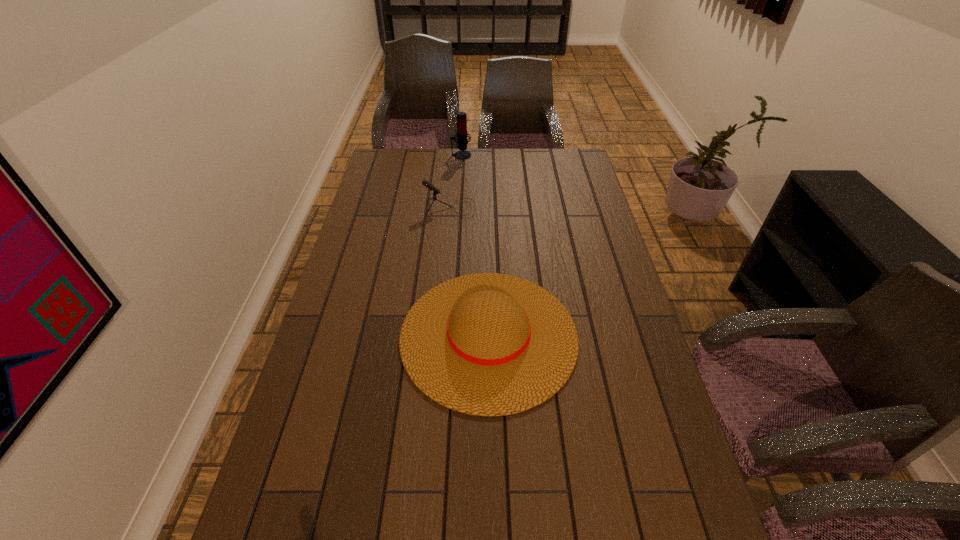
Identify which microphone is the nearest to the nearest object. Please provide its 2D coordinates. Your answer should be formatted as a tuple, i.e. [(x, y)], where the tuple contains the x and y coordinates of a point satisfying the conditions above.

[(430, 186)]

This screenshot has width=960, height=540. I want to click on vacant space that satisfies the following two spatial constraints: 1. on the back side of the nearest object; 2. on the stand of the nearer microphone, so click(x=487, y=208).

Identify the location of vacant position in the image that satisfies the following two spatial constraints: 1. on the stand of the nearest object; 2. on the left side of the second farthest object. Image resolution: width=960 pixels, height=540 pixels. (439, 336).

Locate an element on the screen. vacant space that satisfies the following two spatial constraints: 1. on the front side of the bonnet; 2. on the left side of the taller microphone is located at coordinates (449, 336).

You are a GUI agent. You are given a task and a screenshot of the screen. Output one action in this format:
    pyautogui.click(x=<x>, y=<y>)
    Task: Click on the vacant space that satisfies the following two spatial constraints: 1. on the front side of the farther microphone; 2. on the left side of the bonnet
    This screenshot has width=960, height=540.
    Given the screenshot: What is the action you would take?
    pyautogui.click(x=449, y=336)